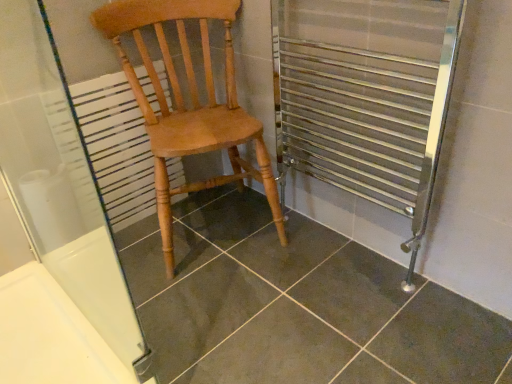
Question: Is light brown wood chair at center to the left or to the right of transparent glass screen door at upper left in the image?

Choices:
 (A) right
 (B) left

Answer: (A)

Question: Relative to transparent glass screen door at upper left, is light brown wood chair at center in front or behind?

Choices:
 (A) front
 (B) behind

Answer: (B)

Question: Based on their relative distances, which object is nearer to the dark gray tile at center?

Choices:
 (A) transparent glass screen door at upper left
 (B) white textured radiator at left
 (C) light brown wood chair at center

Answer: (C)

Question: Estimate the real-world distances between objects in this image. Which object is farther from the light brown wood chair at center?

Choices:
 (A) white textured radiator at left
 (B) transparent glass screen door at upper left
 (C) dark gray tile at center

Answer: (C)